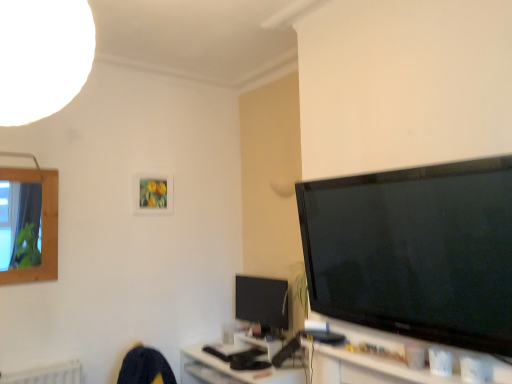
Identify the location of free space above white glossy tv cabinet at lower right (from a real-world perspective). The height and width of the screenshot is (384, 512). (389, 354).